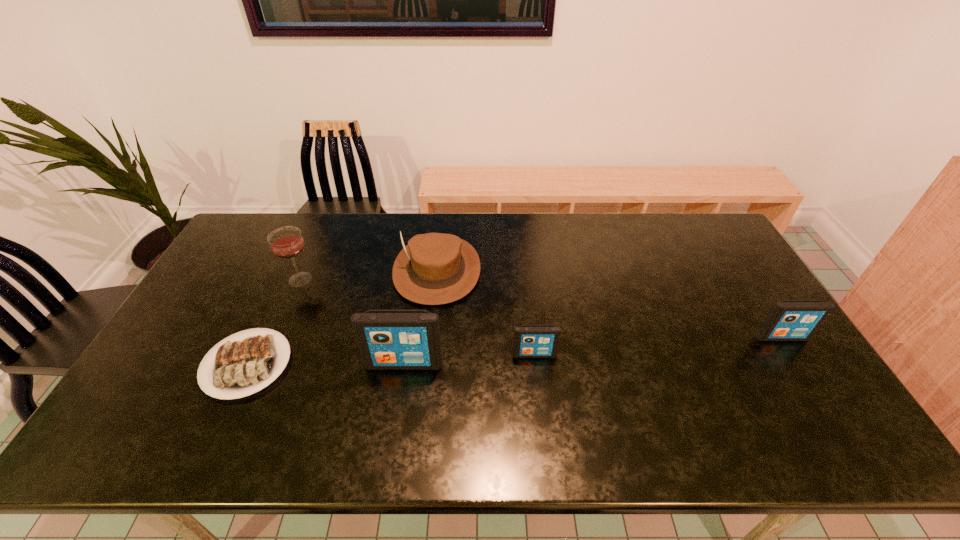
Image resolution: width=960 pixels, height=540 pixels. Find the location of `object identified as the fifth closest to the wineglass`. object identified as the fifth closest to the wineglass is located at coordinates (789, 320).

Find the location of `the second closest iPod to the second object from right to left`. the second closest iPod to the second object from right to left is located at coordinates (789, 320).

Locate an element on the screen. The height and width of the screenshot is (540, 960). the second closest iPod to the wineglass is located at coordinates (530, 341).